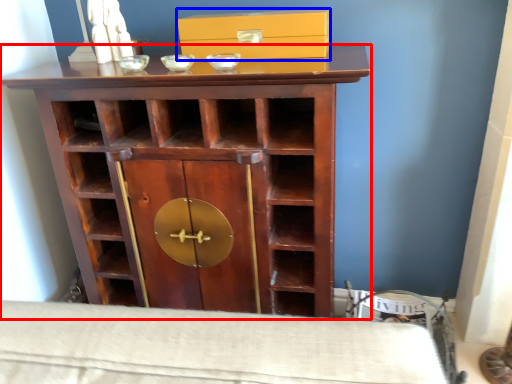
Question: Which object is closer to the camera taking this photo, cupboard (highlighted by a red box) or box (highlighted by a blue box)?

Choices:
 (A) cupboard
 (B) box

Answer: (A)